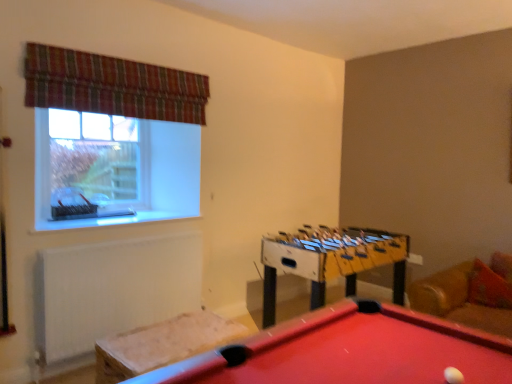
Question: Is the position of yellow plastic foosball table at center more distant than that of clear glass window at upper left?

Choices:
 (A) no
 (B) yes

Answer: (A)

Question: From a real-world perspective, is yellow plastic foosball table at center located beneath clear glass window at upper left?

Choices:
 (A) yes
 (B) no

Answer: (A)

Question: Can you confirm if yellow plastic foosball table at center is thinner than clear glass window at upper left?

Choices:
 (A) no
 (B) yes

Answer: (A)

Question: Is clear glass window at upper left a part of yellow plastic foosball table at center?

Choices:
 (A) no
 (B) yes

Answer: (A)

Question: From the image's perspective, would you say yellow plastic foosball table at center is positioned over clear glass window at upper left?

Choices:
 (A) no
 (B) yes

Answer: (A)

Question: From the image's perspective, is clear glass window at upper left above or below white matte ball at lower right?

Choices:
 (A) below
 (B) above

Answer: (B)

Question: Is clear glass window at upper left inside or outside of white matte ball at lower right?

Choices:
 (A) outside
 (B) inside

Answer: (A)

Question: Considering the relative positions of clear glass window at upper left and white matte ball at lower right in the image provided, is clear glass window at upper left to the left or to the right of white matte ball at lower right?

Choices:
 (A) right
 (B) left

Answer: (B)

Question: Considering the positions of point (61, 144) and point (450, 382), is point (61, 144) closer or farther from the camera than point (450, 382)?

Choices:
 (A) farther
 (B) closer

Answer: (A)

Question: Is point (313, 253) closer or farther from the camera than point (391, 337)?

Choices:
 (A) farther
 (B) closer

Answer: (A)

Question: Considering the positions of yellow plastic foosball table at center and rubberized red pool table at lower center in the image, is yellow plastic foosball table at center bigger or smaller than rubberized red pool table at lower center?

Choices:
 (A) small
 (B) big

Answer: (B)

Question: From the image's perspective, is yellow plastic foosball table at center positioned above or below rubberized red pool table at lower center?

Choices:
 (A) below
 (B) above

Answer: (B)

Question: Would you say yellow plastic foosball table at center is to the left or to the right of rubberized red pool table at lower center in the picture?

Choices:
 (A) right
 (B) left

Answer: (A)

Question: Which is correct: rubberized red pool table at lower center is inside plaid fabric curtain at upper left, or outside of it?

Choices:
 (A) inside
 (B) outside

Answer: (B)

Question: From a real-world perspective, is rubberized red pool table at lower center physically located above or below plaid fabric curtain at upper left?

Choices:
 (A) above
 (B) below

Answer: (B)